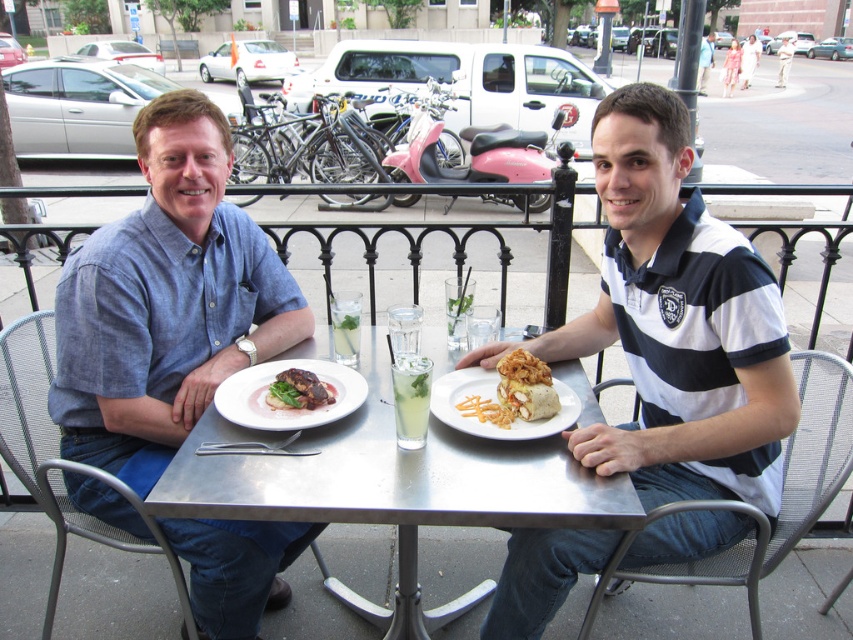
Between white striped polo shirt at center and metallic silver table at center, which one is positioned higher?

Positioned higher is white striped polo shirt at center.

Does white striped polo shirt at center have a greater height compared to metallic silver table at center?

Yes, white striped polo shirt at center is taller than metallic silver table at center.

Image resolution: width=853 pixels, height=640 pixels. What do you see at coordinates (676, 323) in the screenshot? I see `white striped polo shirt at center` at bounding box center [676, 323].

The height and width of the screenshot is (640, 853). Identify the location of white striped polo shirt at center. (676, 323).

Who is shorter, metallic silver table at center or white glossy plate at center?

Standing shorter between the two is white glossy plate at center.

Describe the element at coordinates (393, 484) in the screenshot. I see `metallic silver table at center` at that location.

Which is behind, point (503, 502) or point (323, 376)?

Point (323, 376)

The width and height of the screenshot is (853, 640). What are the coordinates of `metallic silver table at center` in the screenshot? It's located at [x=393, y=484].

Is point (544, 401) farther from viewer compared to point (344, 317)?

No.

Is golden crispy fries at center thinner than clear glass at table center?

No.

The image size is (853, 640). Describe the element at coordinates (520, 390) in the screenshot. I see `golden crispy fries at center` at that location.

This screenshot has width=853, height=640. What are the coordinates of `golden crispy fries at center` in the screenshot? It's located at (520, 390).